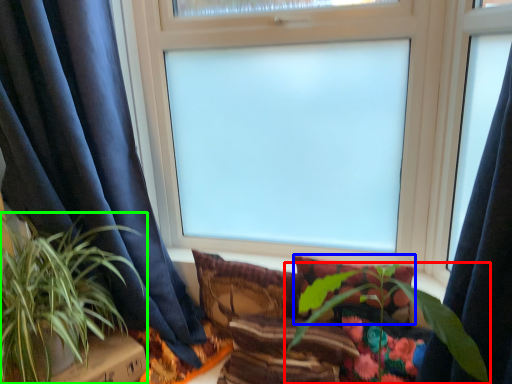
Question: Which is nearer to the houseplant (highlighted by a red box)? pillow (highlighted by a blue box) or houseplant (highlighted by a green box).

Choices:
 (A) pillow
 (B) houseplant

Answer: (A)